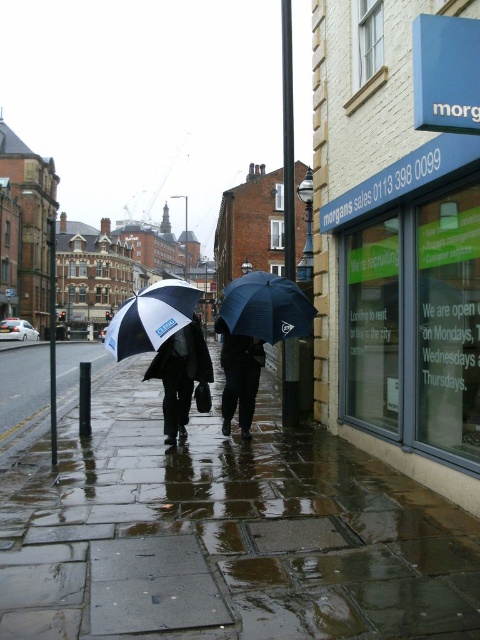
Does blue glass storefront at center right appear on the right side of white and black umbrella at center?

Result: Indeed, blue glass storefront at center right is positioned on the right side of white and black umbrella at center.

Who is more distant from viewer, (394, 406) or (183, 294)?

The point (183, 294) is behind.

Between point (472, 433) and point (169, 291), which one is positioned behind?

The point (169, 291) is more distant.

Where is `blue glass storefront at center right`? The height and width of the screenshot is (640, 480). blue glass storefront at center right is located at coordinates tap(394, 252).

Which of these two, blue glass storefront at center right or dark blue fabric umbrella at center, stands taller?

blue glass storefront at center right is taller.

Which of these two, blue glass storefront at center right or dark blue fabric umbrella at center, stands shorter?

dark blue fabric umbrella at center

At what (x,y) coordinates should I click in order to perform the action: click on blue glass storefront at center right. Please return your answer as a coordinate pair (x, y). This screenshot has height=640, width=480. Looking at the image, I should click on (394, 252).

Can you confirm if dark blue matte umbrella at center is positioned to the left of white and black umbrella at center?

No, dark blue matte umbrella at center is not to the left of white and black umbrella at center.

Can you confirm if dark blue matte umbrella at center is taller than white and black umbrella at center?

No.

Is point (243, 333) positioned after point (121, 337)?

That is True.

Find the location of a particular element. This screenshot has height=640, width=480. dark blue matte umbrella at center is located at coordinates (266, 307).